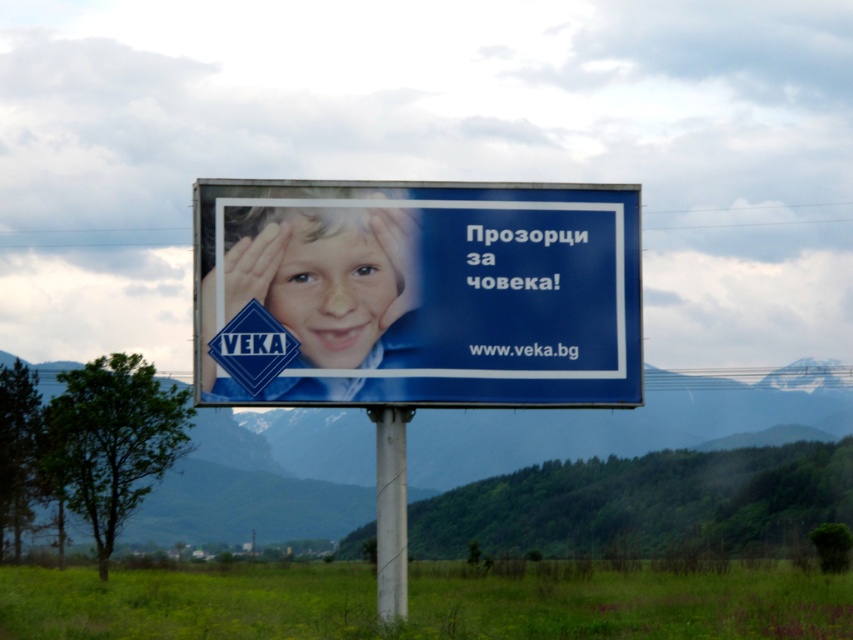
Question: Among these points, which one is nearest to the camera?

Choices:
 (A) (554, 204)
 (B) (343, 241)

Answer: (B)

Question: Can you confirm if matte blue face at center is wider than white plastic pole at center?

Choices:
 (A) no
 (B) yes

Answer: (A)

Question: Does matte blue face at center have a lesser width compared to white plastic pole at center?

Choices:
 (A) yes
 (B) no

Answer: (A)

Question: In this image, where is blue glossy billboard at center located relative to white plastic pole at center?

Choices:
 (A) above
 (B) below

Answer: (A)

Question: Estimate the real-world distances between objects in this image. Which object is farther from the blue glossy billboard at center?

Choices:
 (A) white plastic pole at center
 (B) matte blue face at center

Answer: (A)

Question: Which is nearer to the blue glossy billboard at center?

Choices:
 (A) white plastic pole at center
 (B) matte blue face at center

Answer: (B)